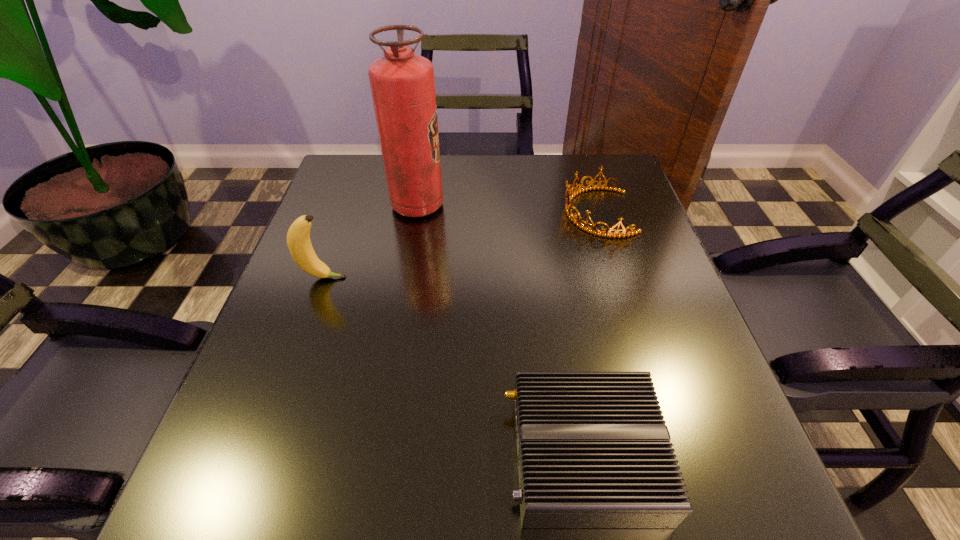
Point out which object is positioned as the second nearest to the tallest object. Please provide its 2D coordinates. Your answer should be formatted as a tuple, i.e. [(x, y)], where the tuple contains the x and y coordinates of a point satisfying the conditions above.

[(593, 230)]

The height and width of the screenshot is (540, 960). I want to click on the third closest object to the second tallest object, so click(x=593, y=230).